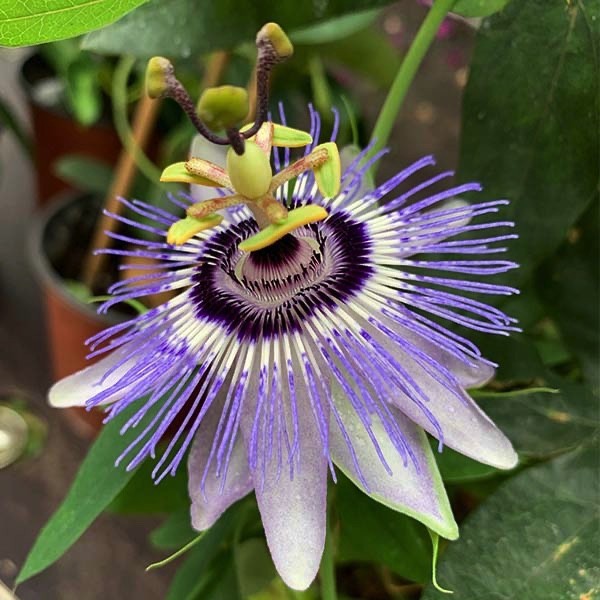
This screenshot has width=600, height=600. Identify the location of plant. (168, 21).